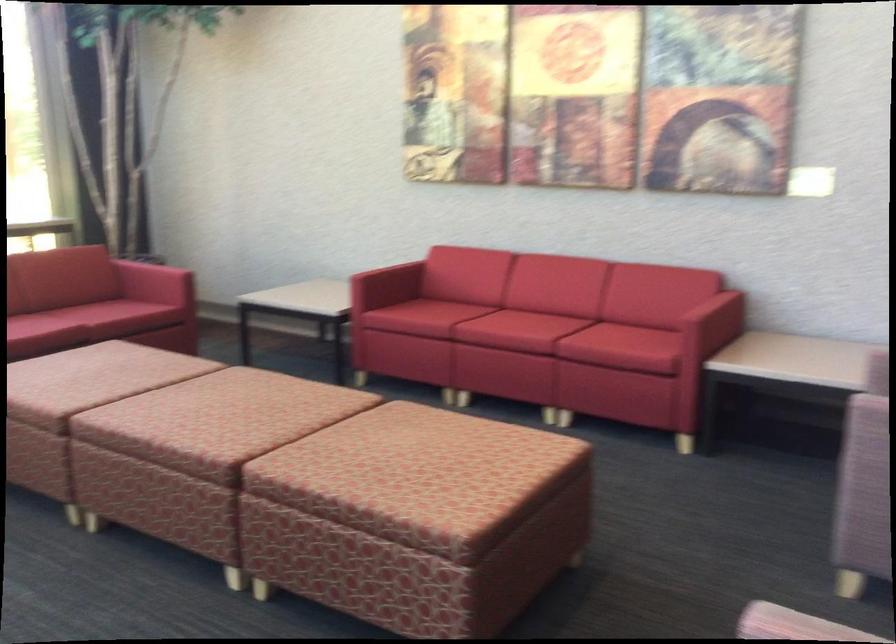
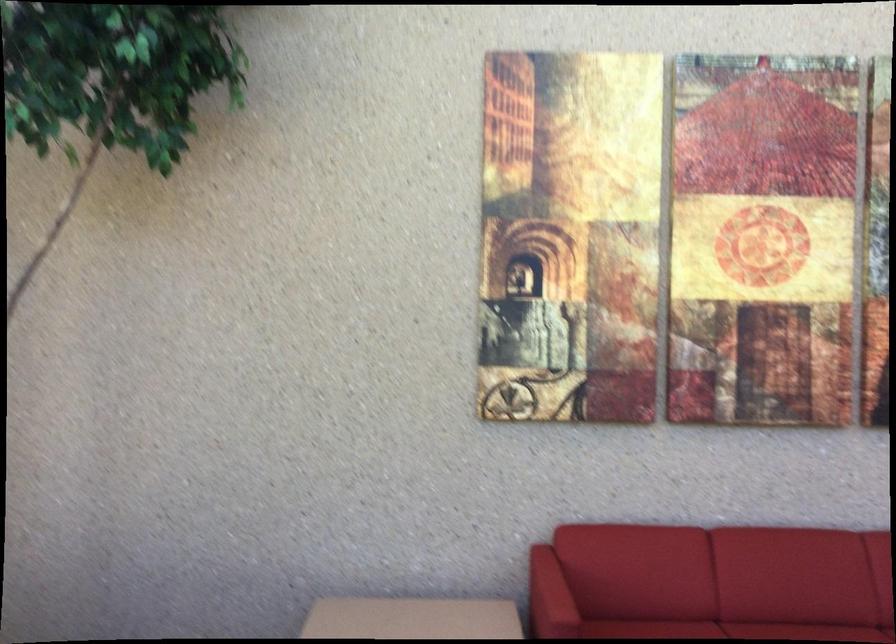
The point at (492, 305) is marked in the first image. Where is the corresponding point in the second image?

(727, 630)